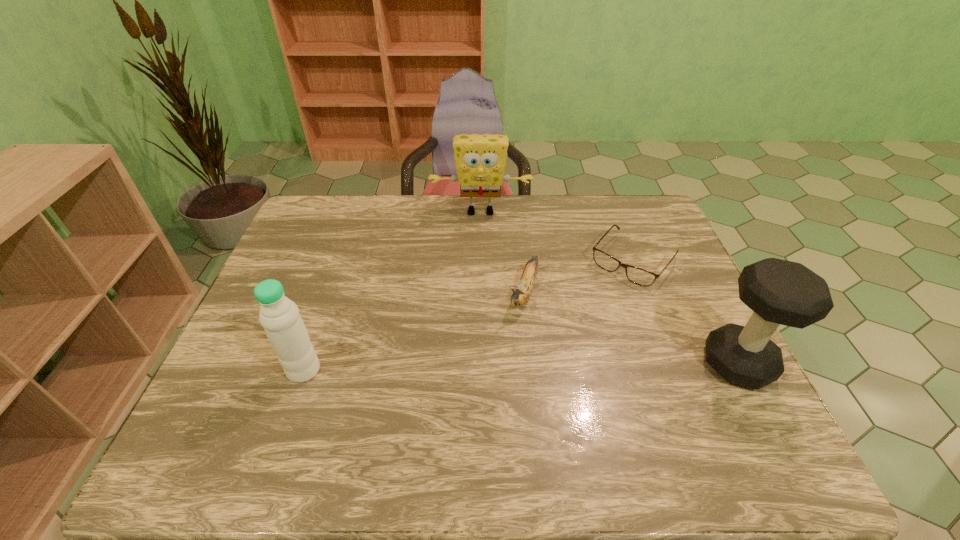
The width and height of the screenshot is (960, 540). I want to click on free area in between the leftmost object and the dumbbell, so (520, 367).

This screenshot has height=540, width=960. I want to click on vacant space in between the dumbbell and the second shortest object, so click(631, 328).

I want to click on vacant point located between the dumbbell and the farthest object, so [x=609, y=287].

At what (x,y) coordinates should I click in order to perform the action: click on free space between the farthest object and the dumbbell. Please return your answer as a coordinate pair (x, y). The width and height of the screenshot is (960, 540). Looking at the image, I should click on point(609,287).

Locate an element on the screen. unoccupied position between the fourth tallest object and the farthest object is located at coordinates (502, 252).

This screenshot has height=540, width=960. I want to click on free space between the leftmost object and the banana, so click(414, 332).

Identify the location of free spot between the farthest object and the water bottle. (392, 291).

I want to click on empty space that is in between the water bottle and the spectacles, so click(x=468, y=315).

Image resolution: width=960 pixels, height=540 pixels. I want to click on empty space that is in between the banana and the dumbbell, so click(x=631, y=328).

Locate an element on the screen. Image resolution: width=960 pixels, height=540 pixels. empty space that is in between the dumbbell and the spectacles is located at coordinates (685, 312).